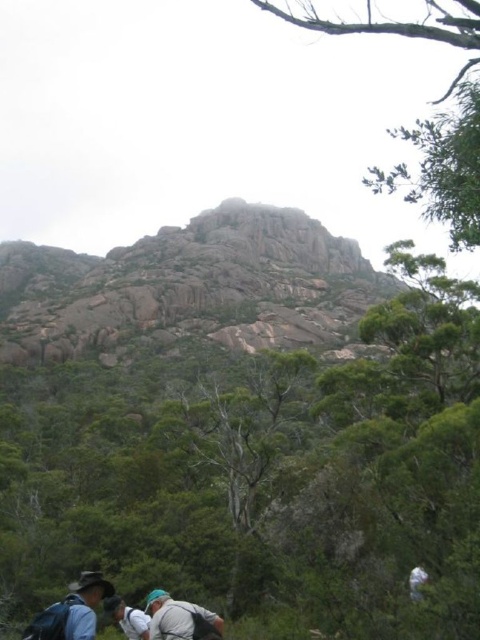
The image size is (480, 640). What do you see at coordinates (191, 285) in the screenshot?
I see `rocky gray mountain at center` at bounding box center [191, 285].

This screenshot has height=640, width=480. Describe the element at coordinates (191, 285) in the screenshot. I see `rocky gray mountain at center` at that location.

You are a GUI agent. You are given a task and a screenshot of the screen. Output one action in this format:
    pyautogui.click(x=<x>, y=<y>)
    Task: Click on the rocky gray mountain at center
    This screenshot has height=640, width=480.
    Given the screenshot: What is the action you would take?
    pyautogui.click(x=191, y=285)

Does point (299, 236) come in front of point (170, 630)?

That is False.

Where is `rocky gray mountain at center`? rocky gray mountain at center is located at coordinates (191, 285).

Is light blue fabric backpack at lower left shorter than light gray fabric backpack at lower center?

Yes, light blue fabric backpack at lower left is shorter than light gray fabric backpack at lower center.

Between point (83, 600) and point (165, 630), which one is positioned behind?

The point (83, 600) is more distant.

Identify the location of light blue fabric backpack at lower left. The height and width of the screenshot is (640, 480). (72, 611).